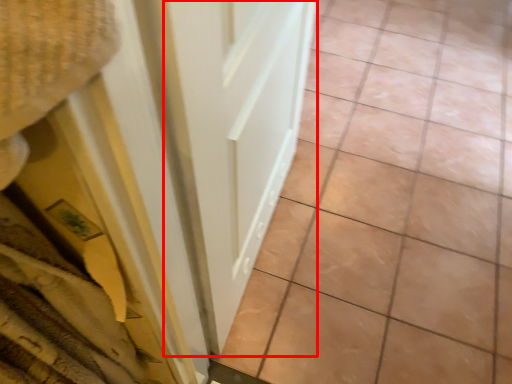
Question: From the image's perspective, where is door (annotated by the red box) located relative to ceramic tile?

Choices:
 (A) above
 (B) below

Answer: (B)